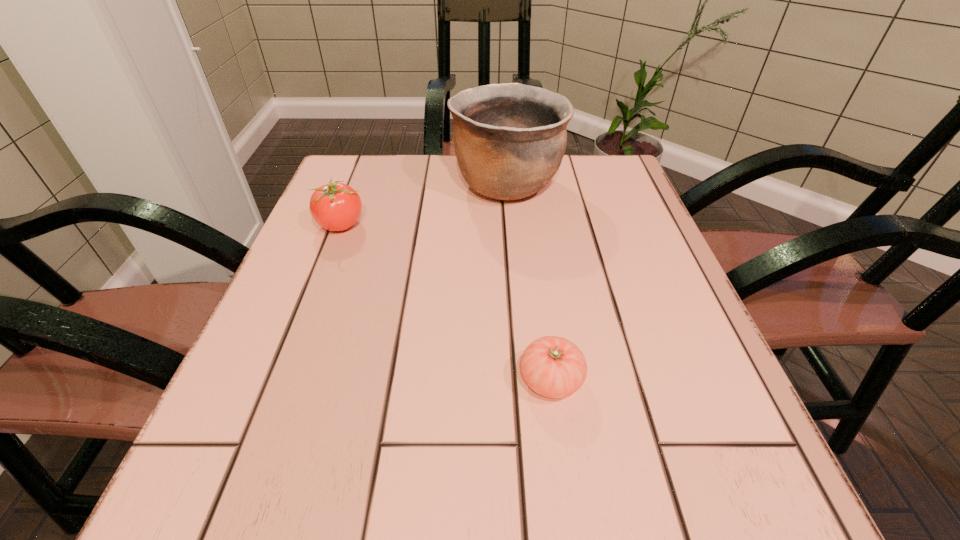
Where is `blank region between the tallest object and the second tallest object`? blank region between the tallest object and the second tallest object is located at coordinates (424, 205).

Find the location of a particular element. The width and height of the screenshot is (960, 540). empty space between the shortest object and the farther tomato is located at coordinates (446, 302).

Find the location of a particular element. The height and width of the screenshot is (540, 960). vacant point located between the nearer tomato and the tallest object is located at coordinates (529, 282).

Where is `vacant area that lies between the farther tomato and the nearer tomato`? The width and height of the screenshot is (960, 540). vacant area that lies between the farther tomato and the nearer tomato is located at coordinates (446, 302).

At what (x,y) coordinates should I click in order to perform the action: click on free spot between the second shortest object and the right tomato. Please return your answer as a coordinate pair (x, y). Looking at the image, I should click on (446, 302).

The width and height of the screenshot is (960, 540). I want to click on free spot between the shorter tomato and the taller tomato, so click(x=446, y=302).

You are a GUI agent. You are given a task and a screenshot of the screen. Output one action in this format:
    pyautogui.click(x=<x>, y=<y>)
    Task: Click on the object that is the second closest one to the pottery
    The image size is (960, 540).
    Given the screenshot: What is the action you would take?
    pyautogui.click(x=554, y=367)

Select which object is the closest to the second tallest object. Please provide its 2D coordinates. Your answer should be formatted as a tuple, i.e. [(x, y)], where the tuple contains the x and y coordinates of a point satisfying the conditions above.

[(509, 139)]

This screenshot has height=540, width=960. I want to click on free point that satisfies the following two spatial constraints: 1. on the front side of the farther tomato; 2. on the right side of the shorter tomato, so pos(281,380).

I want to click on vacant space that satisfies the following two spatial constraints: 1. on the back side of the second tallest object; 2. on the right side of the pottery, so [x=357, y=184].